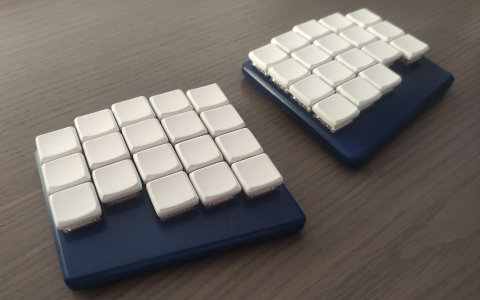
I want to click on square blue pads, so click(377, 129), click(183, 241).